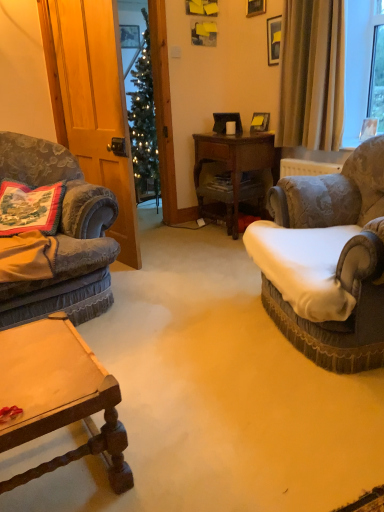
Question: Is velvet fabric armchair at left, arranged as the second chair when viewed from the right, in front of or behind matte white mug at center in the image?

Choices:
 (A) front
 (B) behind

Answer: (A)

Question: From a real-world perspective, is velvet fabric armchair at left, which is counted as the 1th chair, starting from the left, positioned above or below matte white mug at center?

Choices:
 (A) above
 (B) below

Answer: (B)

Question: Estimate the real-world distances between objects in this image. Which object is closer to the beige fabric curtain at upper right?

Choices:
 (A) matte white mug at center
 (B) metallic gold picture frame at upper center, the 1th picture frame viewed from the back
 (C) velvet-patterned armchair at right, which is the second chair from left to right
 (D) velvet fabric armchair at left, which is counted as the 1th chair, starting from the left
 (E) embroidered fabric pillow at left

Answer: (A)

Question: Which object is positioned closest to the velvet-patterned armchair at right, which is the second chair from left to right?

Choices:
 (A) embroidered fabric pillow at left
 (B) matte white mug at center
 (C) velvet fabric armchair at left, arranged as the second chair when viewed from the right
 (D) wooden desk at center
 (E) metallic gold picture frame at upper center, the 1th picture frame from the left

Answer: (C)